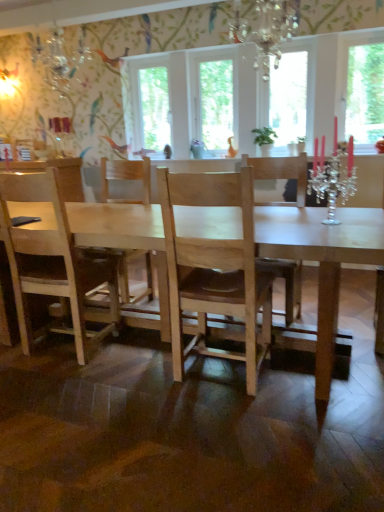
Identify the location of empty space that is ontop of transparent glass window at upper right, positioned as the first window screen in right-to-left order. (367, 33).